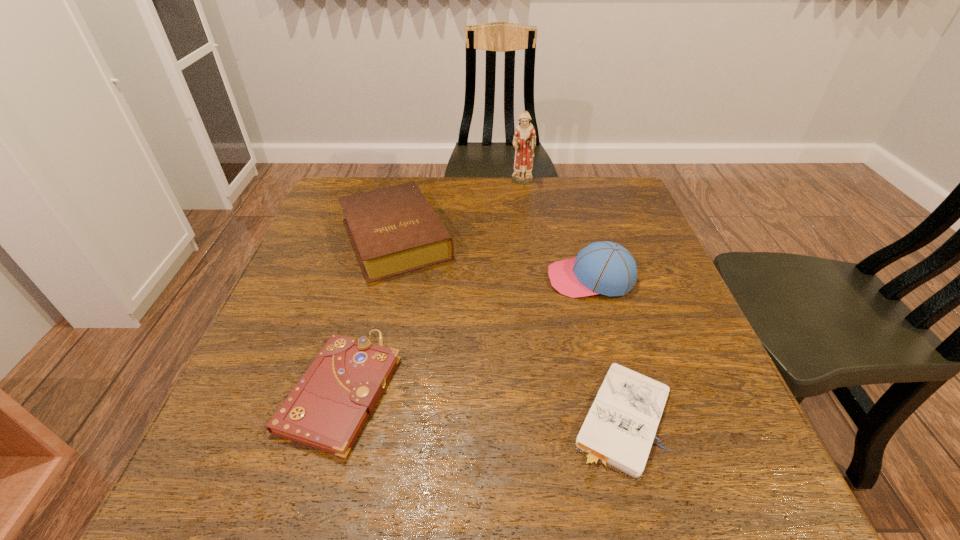
I want to click on vacant space located 0.340m on the front-facing side of the second tallest object, so click(x=400, y=279).

Image resolution: width=960 pixels, height=540 pixels. What are the coordinates of `vacant space situated 0.080m on the front-facing side of the second tallest object` in the screenshot? It's located at (513, 279).

I want to click on blank space located on the back of the Bible, so click(410, 179).

Where is `free location located 0.300m on the back of the fourth tallest object`? Image resolution: width=960 pixels, height=540 pixels. free location located 0.300m on the back of the fourth tallest object is located at coordinates (381, 244).

Where is `free space located on the back of the shortest object`? The image size is (960, 540). free space located on the back of the shortest object is located at coordinates (591, 302).

Image resolution: width=960 pixels, height=540 pixels. Identify the location of figurine located in the far edge section of the desktop. (524, 141).

The image size is (960, 540). I want to click on Bible located at the far edge, so click(x=394, y=230).

Locate an element on the screen. This screenshot has width=960, height=540. Bible located at the left edge is located at coordinates (394, 230).

The height and width of the screenshot is (540, 960). What are the coordinates of `notebook present at the left edge` in the screenshot? It's located at (326, 410).

The image size is (960, 540). I want to click on baseball cap that is positioned at the right edge, so pos(603,267).